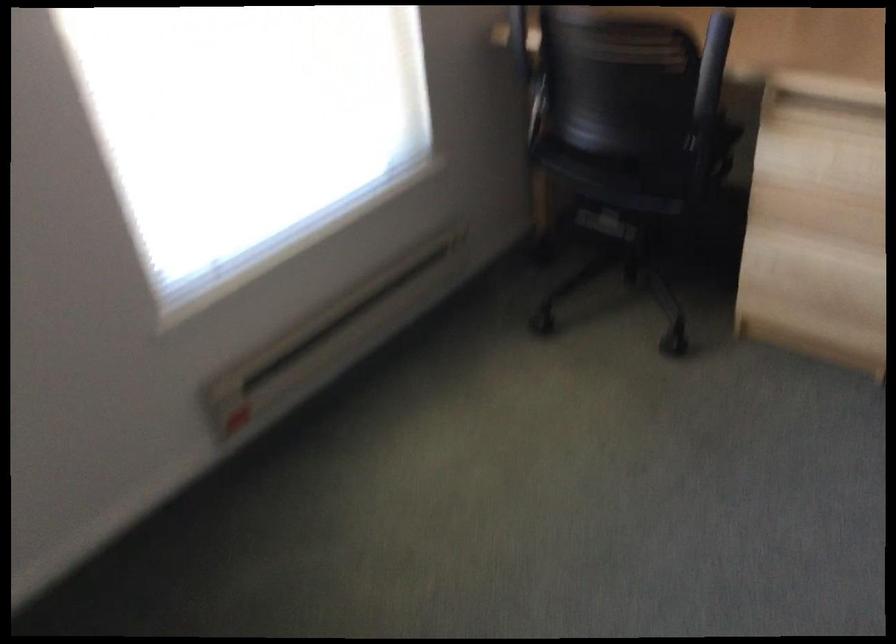
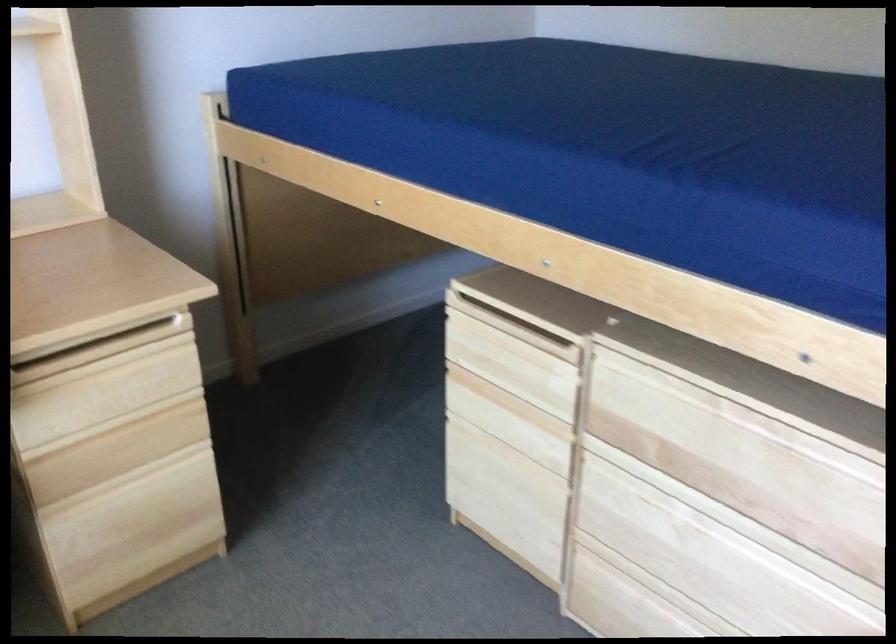
Question: The camera is either moving clockwise (left) or counter-clockwise (right) around the object. The first image is from the beginning of the video and the second image is from the end. Is the camera moving left or right when shooting the video?

Choices:
 (A) Left
 (B) Right

Answer: (A)